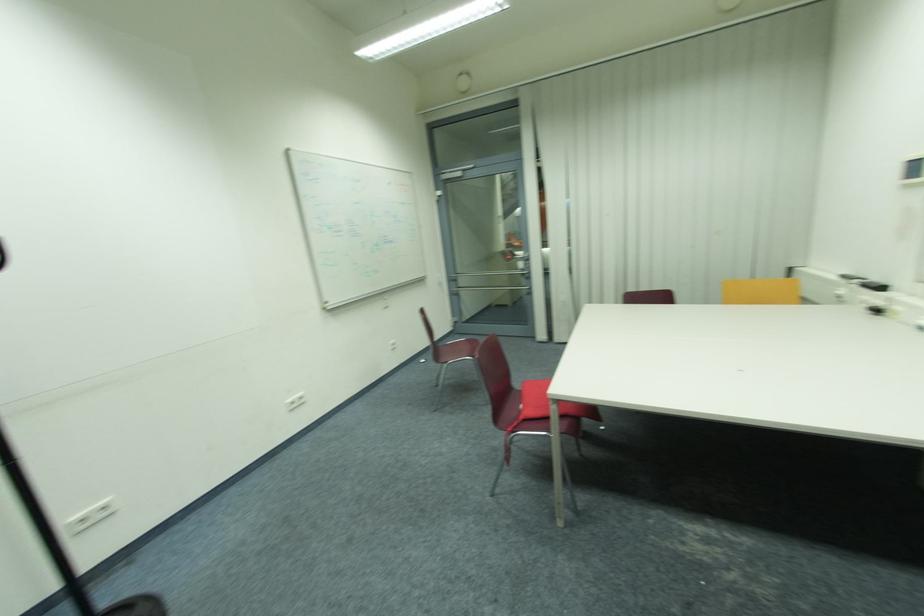
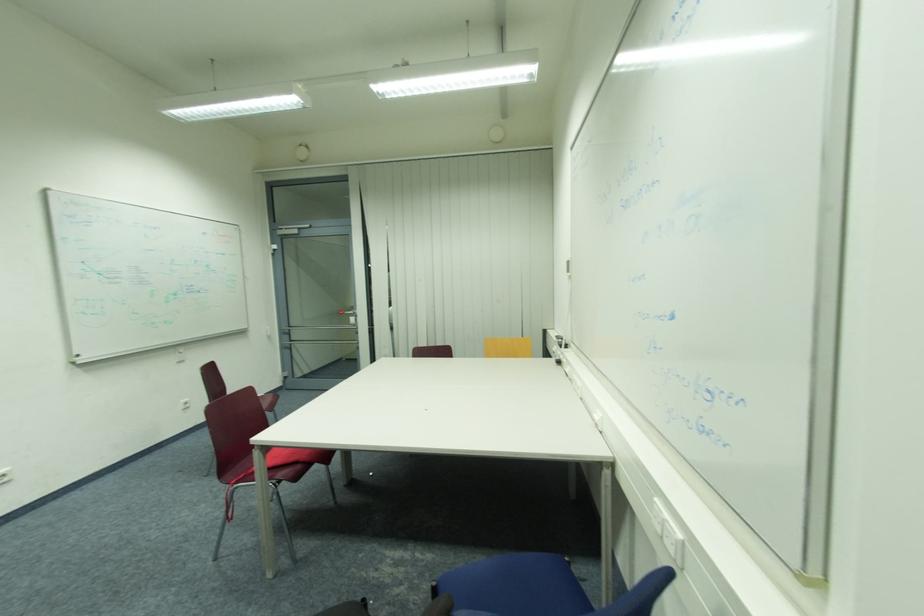
What movement of the cameraman would produce the second image?

The movement direction of the cameraman is right, backward.